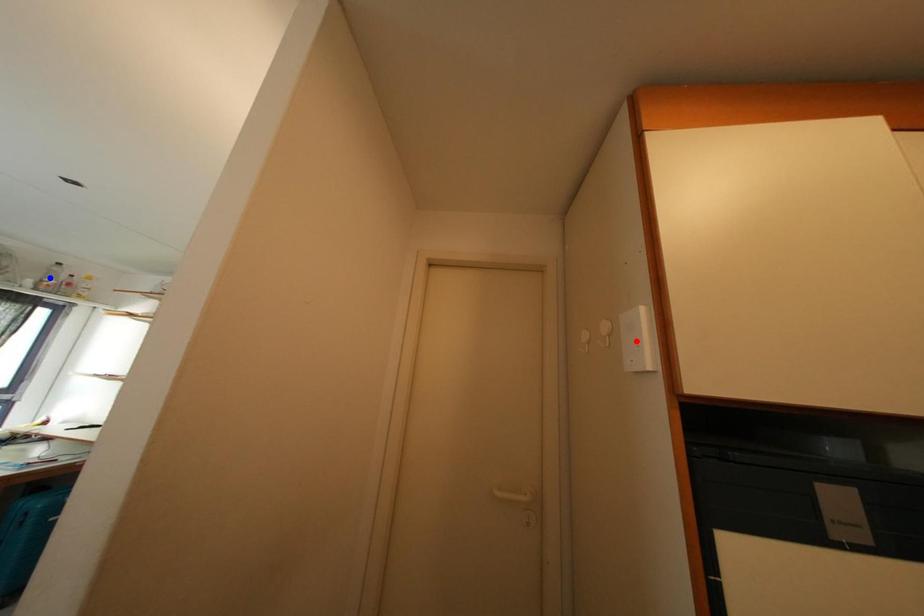
Question: In the image, two points are highlighted. Which point is nearer to the camera? Reply with the corresponding letter.

Choices:
 (A) blue point
 (B) red point

Answer: (B)